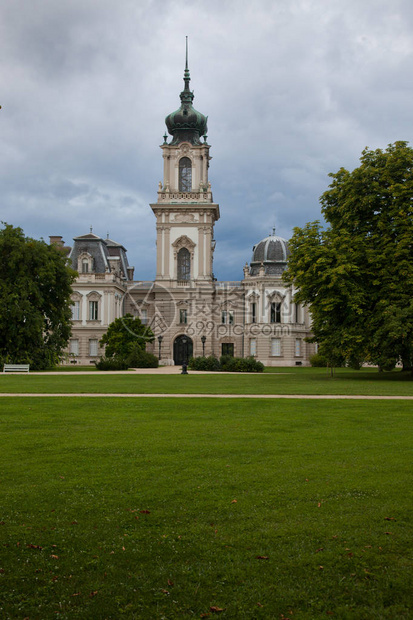
Identify the location of doorway. (179, 347), (229, 350).